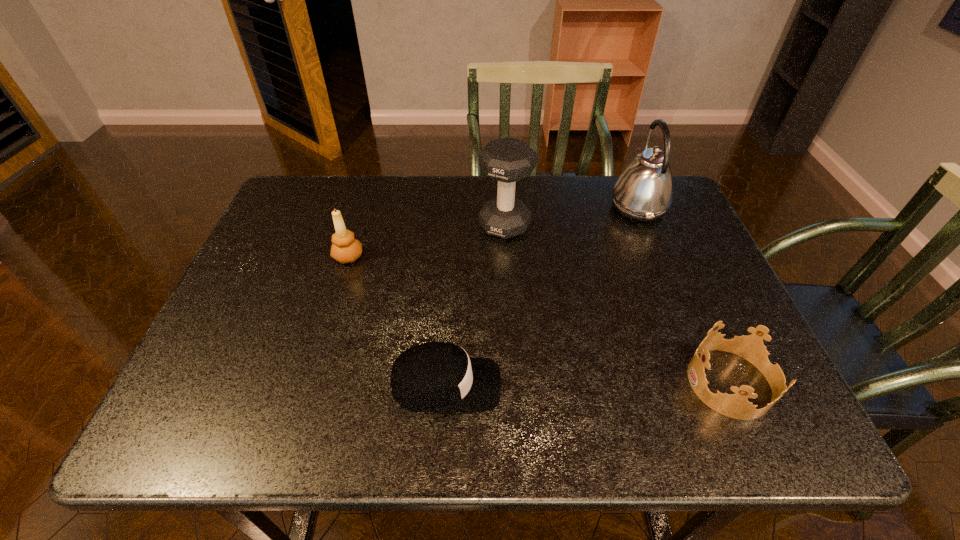
The image size is (960, 540). I want to click on vacant area located 0.230m on the front of the third nearest object, so click(x=323, y=342).

This screenshot has width=960, height=540. Find the location of `free spot located on the front-facing side of the tiara`. free spot located on the front-facing side of the tiara is located at coordinates coord(600,383).

Locate an element on the screen. vacant space located 0.380m on the front-facing side of the tiara is located at coordinates (501, 383).

The height and width of the screenshot is (540, 960). In order to click on free location located on the front-facing side of the tiara in this screenshot , I will do `click(620, 383)`.

Locate an element on the screen. This screenshot has width=960, height=540. vacant space located 0.080m on the front-facing side of the cap is located at coordinates (540, 384).

Locate an element on the screen. The width and height of the screenshot is (960, 540). kettle that is positioned at the far edge is located at coordinates (644, 192).

What are the coordinates of `dumbbell present at the far edge` in the screenshot? It's located at (507, 160).

You are a GUI agent. You are given a task and a screenshot of the screen. Output one action in this format:
    pyautogui.click(x=<x>, y=<y>)
    Task: Click on the tiara located at the near edge
    The height and width of the screenshot is (540, 960).
    Given the screenshot: What is the action you would take?
    pyautogui.click(x=751, y=347)

Find the location of a particular element. The width and height of the screenshot is (960, 540). cap that is at the near edge is located at coordinates (436, 376).

Where is `kettle that is at the right edge`? This screenshot has height=540, width=960. kettle that is at the right edge is located at coordinates (644, 192).